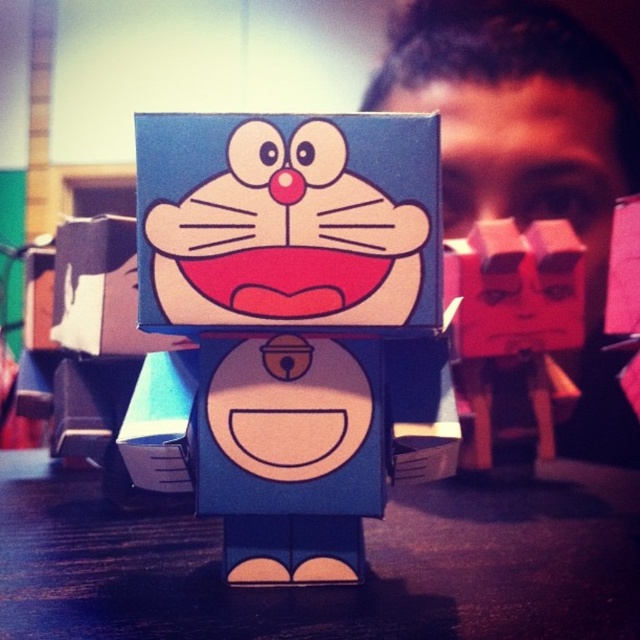
Question: Which of the following is the farthest from the observer?

Choices:
 (A) (474, 152)
 (B) (538, 74)

Answer: (B)

Question: Can you confirm if blue cardboard toy at center is positioned to the left of matte pink cube at center?

Choices:
 (A) yes
 (B) no

Answer: (A)

Question: Which object is farther from the camera taking this photo?

Choices:
 (A) matte pink cube at center
 (B) matte plastic man at center

Answer: (A)

Question: Which point is closer to the camera?

Choices:
 (A) blue cardboard table at center
 (B) matte pink cube at right

Answer: (A)

Question: Can you confirm if matte pink cube at center is wider than matte pink cube at right?

Choices:
 (A) no
 (B) yes

Answer: (B)

Question: Is the position of blue cardboard toy at center less distant than that of matte pink cube at center?

Choices:
 (A) yes
 (B) no

Answer: (A)